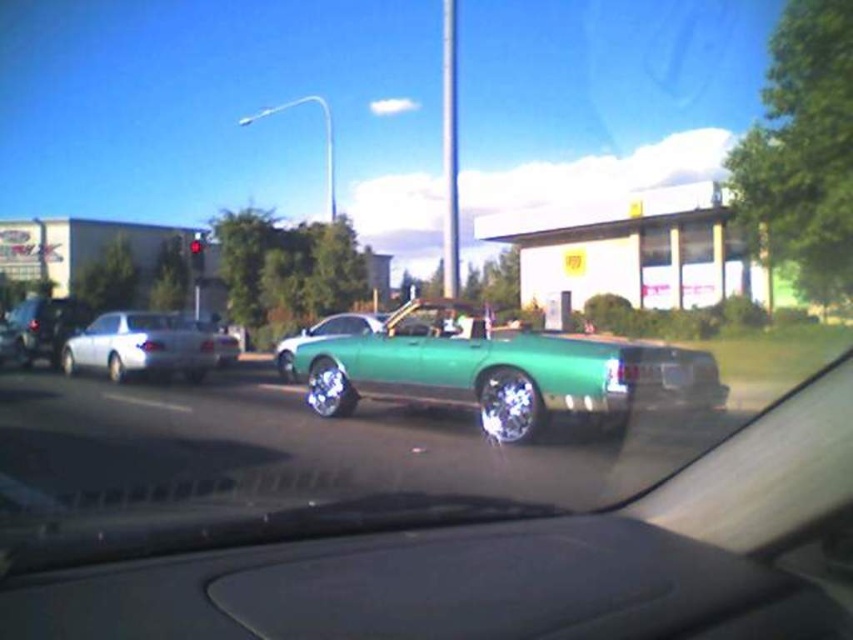
Image resolution: width=853 pixels, height=640 pixels. I want to click on black matte dashboard at center, so click(434, 589).

Does black matte dashboard at center have a lesser width compared to shiny green car at center?

Incorrect, black matte dashboard at center's width is not less than shiny green car at center's.

Does point (508, 611) come in front of point (381, 323)?

Yes.

I want to click on black matte dashboard at center, so click(x=434, y=589).

Which of these two, white glossy sedan at center or shiny green car at center, stands taller?

white glossy sedan at center

Can you confirm if white glossy sedan at center is thinner than shiny green car at center?

No.

Identify the location of white glossy sedan at center. This screenshot has height=640, width=853. coord(140,346).

Looking at this image, can you confirm if black matte dashboard at center is positioned above white glossy sedan at center?

No.

Between point (212, 584) and point (193, 346), which one is positioned behind?

The point (193, 346) is behind.

Where is `black matte dashboard at center`? black matte dashboard at center is located at coordinates (434, 589).